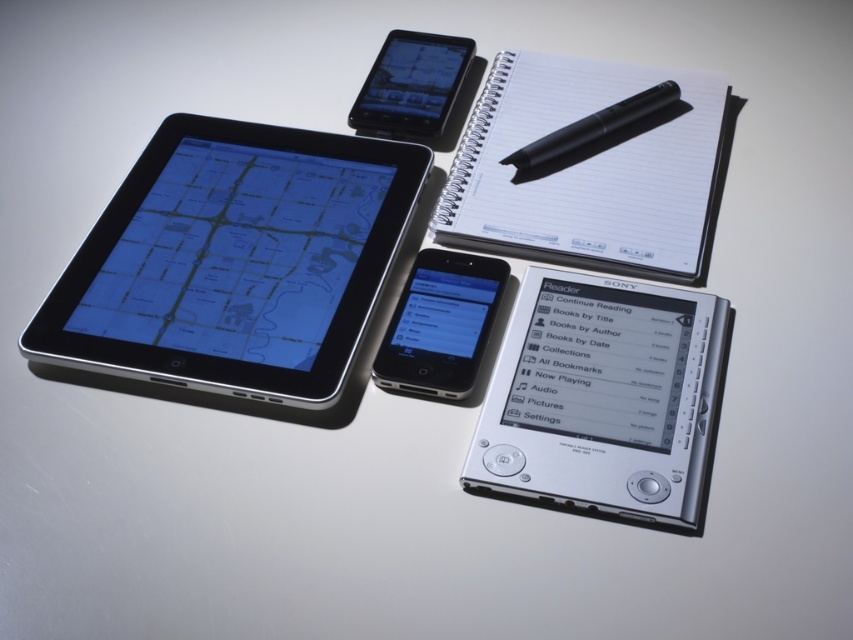
You are looking at the electronic devices on the desk. Which device is located at the coordinates point (410, 84)?

The matte black tablet at upper center is located at point (410, 84).

You are trying to determine the spatial relationship between two points on the image. Which point is closer to the viewer? The points are point (x=407, y=129) and point (x=677, y=92).

Point (x=677, y=92) is closer to the viewer because it is in front of point (x=407, y=129).